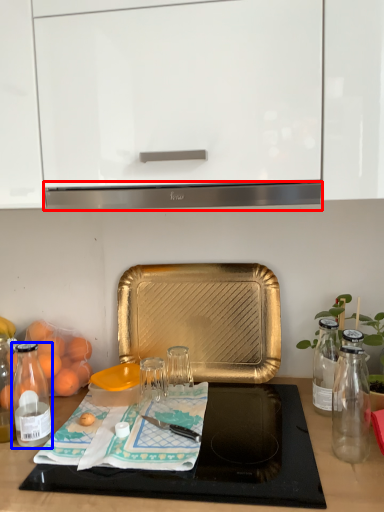
Question: Which object appears farthest to the camera in this image, exhaust hood (highlighted by a red box) or bottle (highlighted by a blue box)?

Choices:
 (A) exhaust hood
 (B) bottle

Answer: (B)